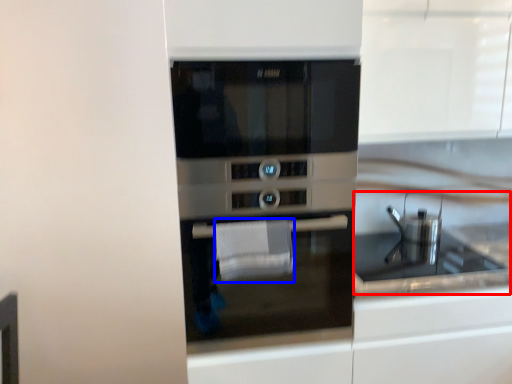
Question: Which object is closer to the camera taking this photo, sink (highlighted by a red box) or hand towel (highlighted by a blue box)?

Choices:
 (A) sink
 (B) hand towel

Answer: (B)